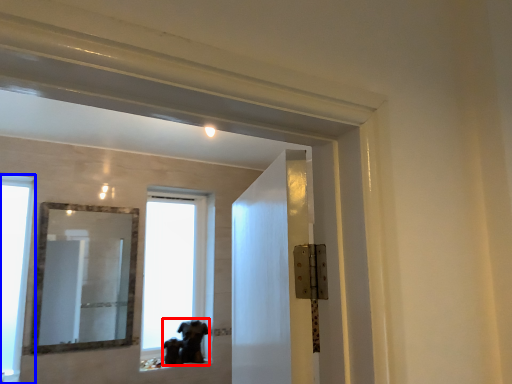
Question: Which point is closer to the camera, animal (highlighted by a red box) or window (highlighted by a blue box)?

Choices:
 (A) animal
 (B) window

Answer: (B)